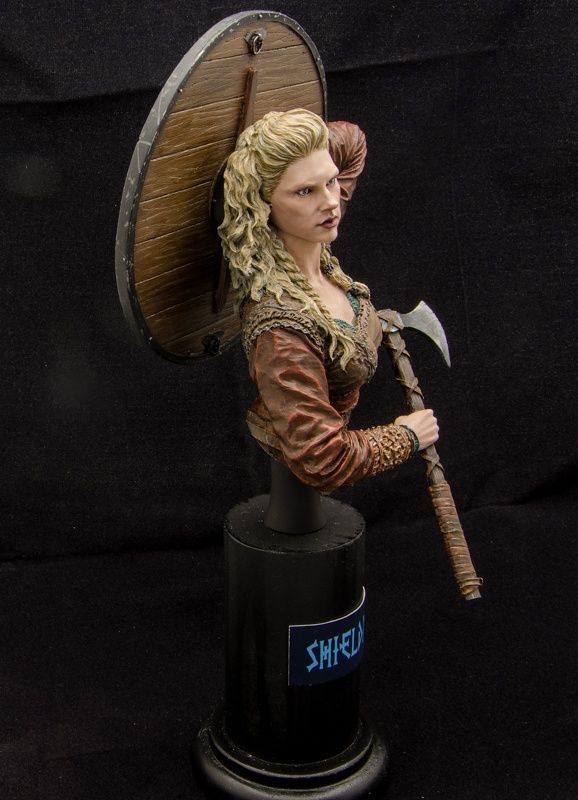
This screenshot has width=578, height=800. I want to click on stand, so click(344, 782).